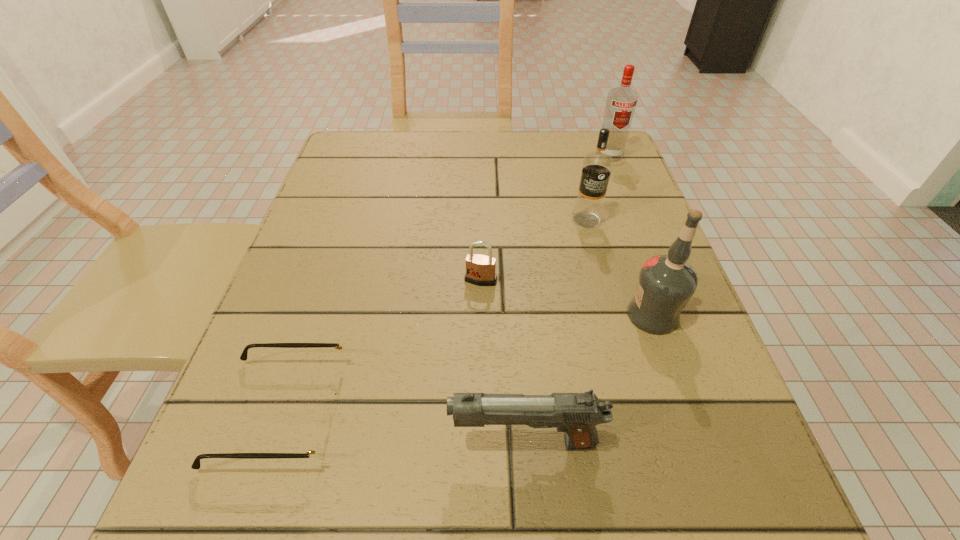
The width and height of the screenshot is (960, 540). I want to click on vacant space that is in between the third shortest object and the nearest vodka, so click(x=588, y=379).

Where is `empty space that is in between the farthest object and the third nearest object`? The height and width of the screenshot is (540, 960). empty space that is in between the farthest object and the third nearest object is located at coordinates (631, 235).

The height and width of the screenshot is (540, 960). In order to click on vacant area that lies between the farthest vodka and the third shortest object in this screenshot , I will do `click(567, 299)`.

Locate an element on the screen. unoccupied area between the farthest object and the fifth tallest object is located at coordinates (545, 218).

This screenshot has height=540, width=960. I want to click on free area in between the spectacles and the second farthest object, so click(434, 316).

Locate an element on the screen. This screenshot has width=960, height=540. blank region between the fourth nearest object and the gun is located at coordinates (503, 361).

Identify the location of the fourth closest object to the farthest vodka. The width and height of the screenshot is (960, 540). (577, 414).

Locate which object is the second closest to the farthest object. Please provide its 2D coordinates. Your answer should be formatted as a tuple, i.e. [(x, y)], where the tuple contains the x and y coordinates of a point satisfying the conditions above.

[(666, 283)]

Locate an element on the screen. the third closest vodka to the fifth tallest object is located at coordinates (621, 103).

At what (x,y) coordinates should I click in order to perform the action: click on the closest vodka to the farthest vodka. Please return your answer as a coordinate pair (x, y). Looking at the image, I should click on click(x=597, y=166).